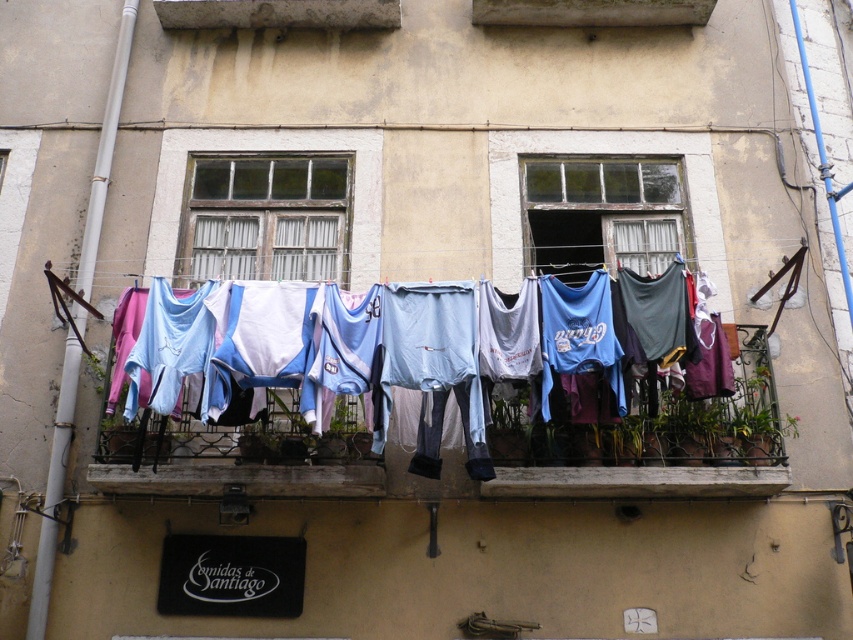
Can you confirm if wooden frame at upper left is shorter than transparent glass window at center?

In fact, wooden frame at upper left may be taller than transparent glass window at center.

Who is more forward, (230, 260) or (561, 250)?

Point (230, 260) is more forward.

Locate an element on the screen. wooden frame at upper left is located at coordinates (265, 218).

Does fabric clothes at center appear on the left side of transparent glass window at center?

Indeed, fabric clothes at center is positioned on the left side of transparent glass window at center.

Can you confirm if fabric clothes at center is taller than transparent glass window at center?

Incorrect, fabric clothes at center's height is not larger of transparent glass window at center's.

The image size is (853, 640). What are the coordinates of `fabric clothes at center` in the screenshot? It's located at coord(463,481).

Is fabric clothes at center positioned before wooden frame at upper left?

Yes, fabric clothes at center is closer to the viewer.

Which is more to the right, fabric clothes at center or wooden frame at upper left?

From the viewer's perspective, fabric clothes at center appears more on the right side.

Between point (631, 496) and point (242, 266), which one is positioned behind?

The point (242, 266) is behind.

This screenshot has height=640, width=853. What are the coordinates of `fabric clothes at center` in the screenshot? It's located at (463, 481).